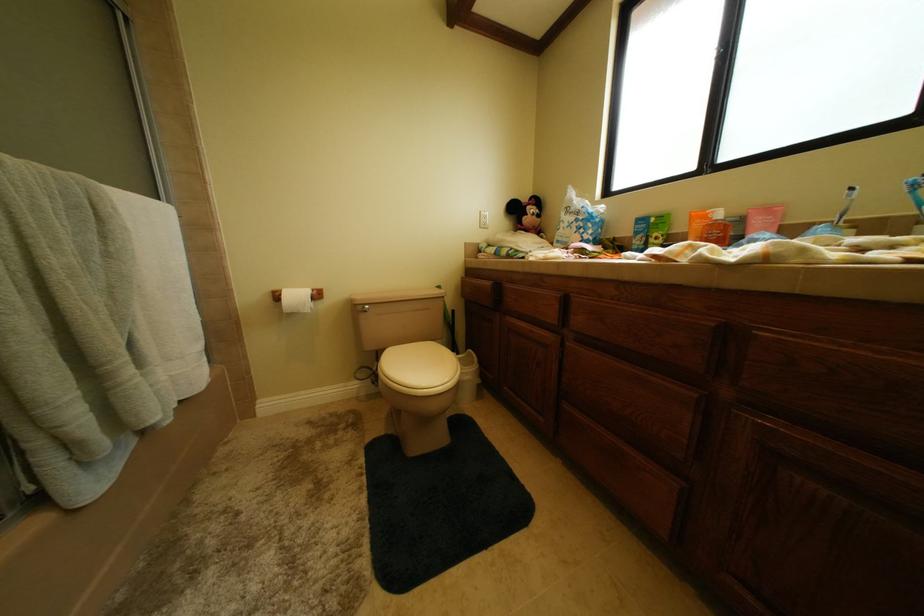
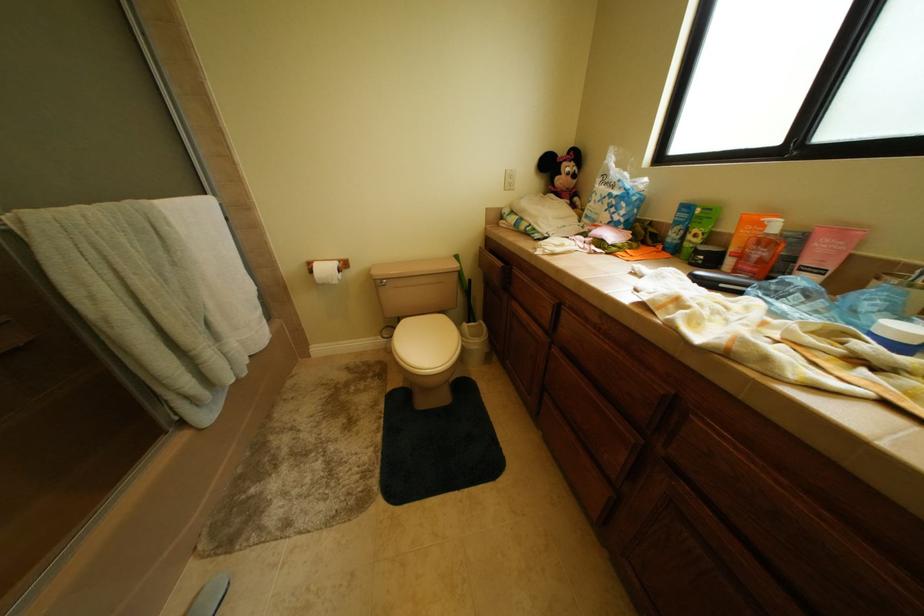
Question: Based on the continuous images, in which direction is the camera rotating? Reply with the corresponding letter.

Choices:
 (A) Left
 (B) Right
 (C) Up
 (D) Down

Answer: (D)